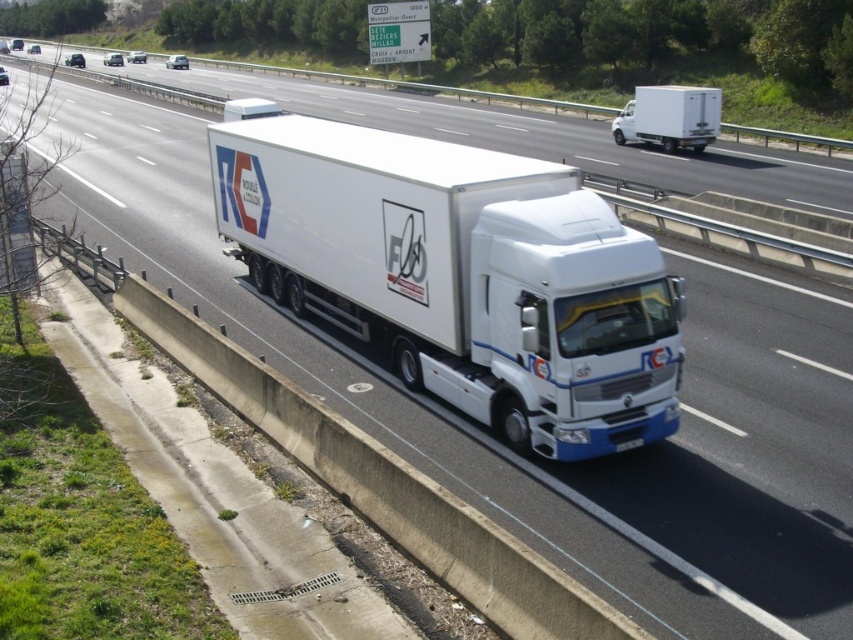
You are a driver on the highway and see the white glossy truck at center and the white matte truck at upper center. Which truck is positioned more to the left side of the road?

The white glossy truck at center is positioned more to the left side of the road compared to the white matte truck at upper center.

You are a delivery driver who needs to pass under a low bridge that has a height restriction of 4 meters. You are currently driving the white matte truck at upper center and see the white matte trailer truck at center behind you. Which vehicle is more likely to hit the bridge if you both continue on this path?

The white matte trailer truck at center is much taller than the white matte truck at upper center, so it is more likely to hit the bridge if both continue on this path.